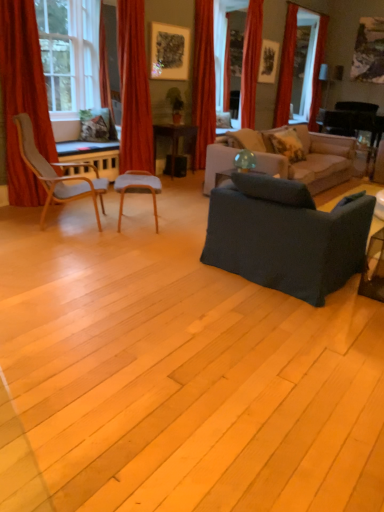
The image size is (384, 512). I want to click on free spot in front of light gray fabric chair at left, which ranks as the 1th chair in left-to-right order, so click(x=53, y=246).